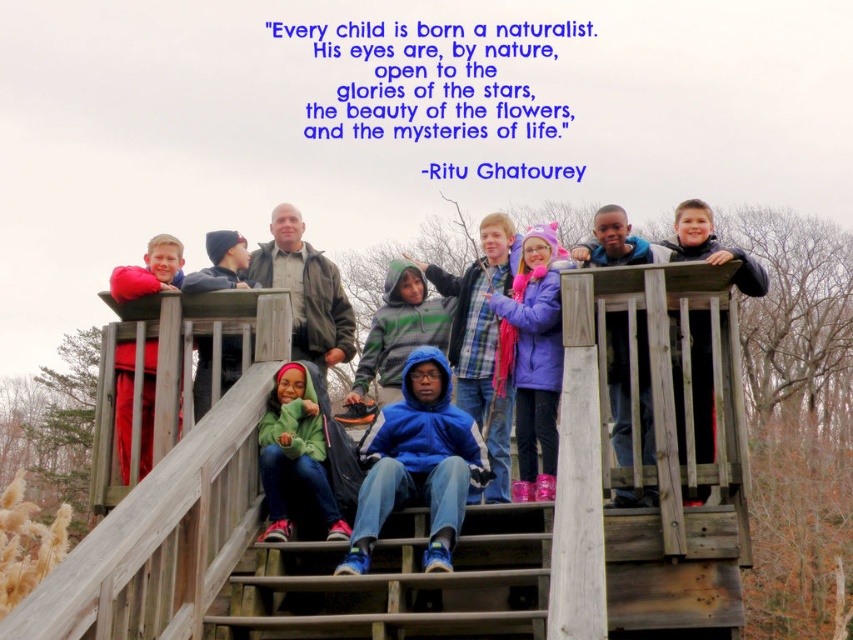
Who is taller, wooden stairs at center or blue fleece hoodie at center?

Standing taller between the two is blue fleece hoodie at center.

The width and height of the screenshot is (853, 640). Identify the location of wooden stairs at center. (397, 586).

Does wooden staircase at center appear on the right side of green fleece jacket at center?

Yes, wooden staircase at center is to the right of green fleece jacket at center.

What do you see at coordinates (666, 378) in the screenshot? The width and height of the screenshot is (853, 640). I see `wooden staircase at center` at bounding box center [666, 378].

The image size is (853, 640). Identify the location of wooden staircase at center. (666, 378).

Between wooden staircase at center and blue fleece hoodie at center, which one is positioned higher?

wooden staircase at center is higher up.

Does wooden staircase at center have a lesser width compared to blue fleece hoodie at center?

No.

Locate an element on the screen. The width and height of the screenshot is (853, 640). wooden staircase at center is located at coordinates (666, 378).

You are a GUI agent. You are given a task and a screenshot of the screen. Output one action in this format:
    pyautogui.click(x=<x>, y=<y>)
    Task: Click on the wooden staircase at center
    The height and width of the screenshot is (640, 853).
    Given the screenshot: What is the action you would take?
    pyautogui.click(x=666, y=378)